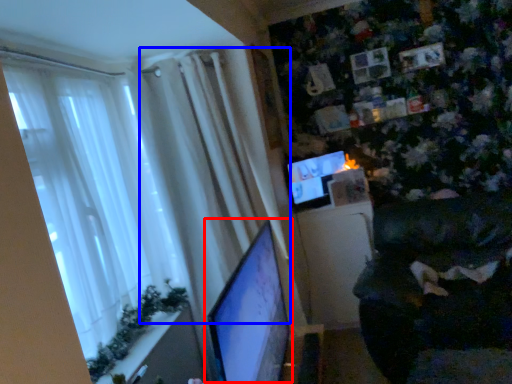
Question: Which object appears closest to the camera in this image, computer monitor (highlighted by a red box) or curtain (highlighted by a blue box)?

Choices:
 (A) computer monitor
 (B) curtain

Answer: (A)